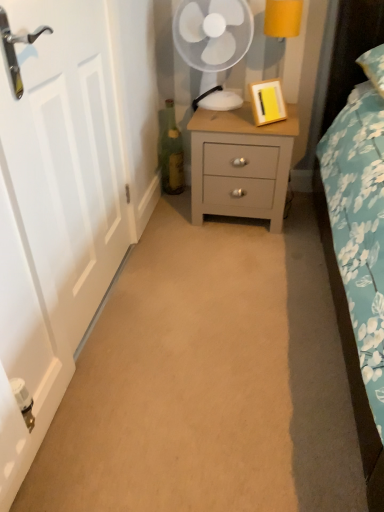
Locate an element on the screen. The height and width of the screenshot is (512, 384). free space in front of green glass bottle at center is located at coordinates (171, 202).